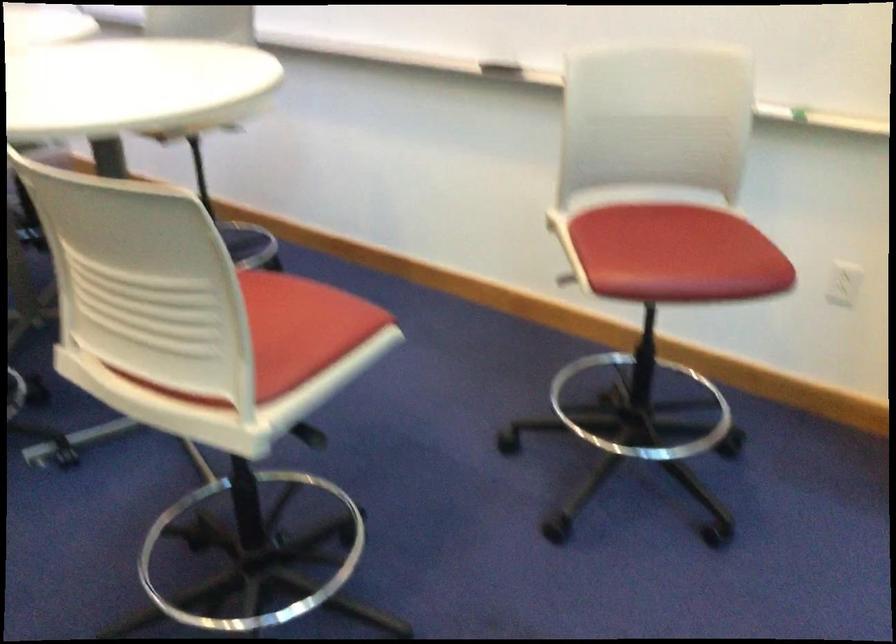
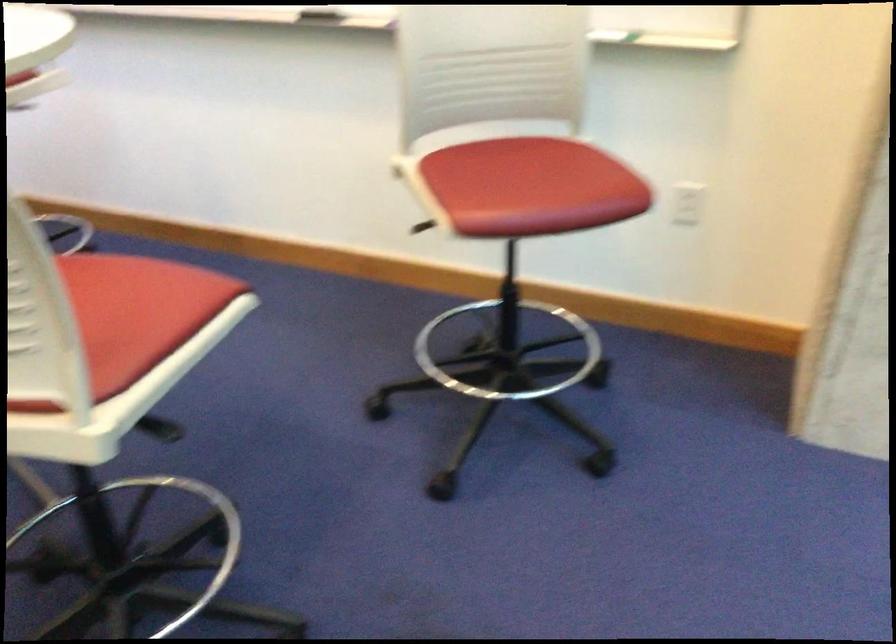
Question: The images are taken continuously from a first-person perspective. In which direction is your viewpoint rotating?

Choices:
 (A) Left
 (B) Right
 (C) Up
 (D) Down

Answer: (B)